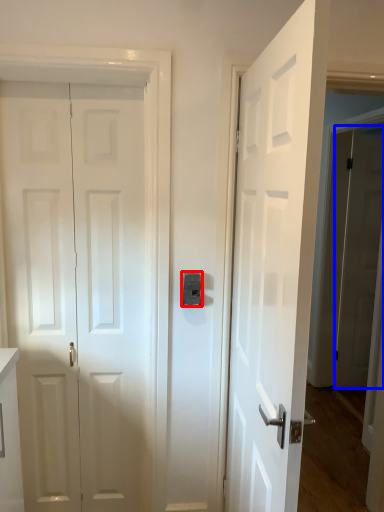
Question: Which object appears closest to the camera in this image, latch (highlighted by a red box) or door (highlighted by a blue box)?

Choices:
 (A) latch
 (B) door

Answer: (A)